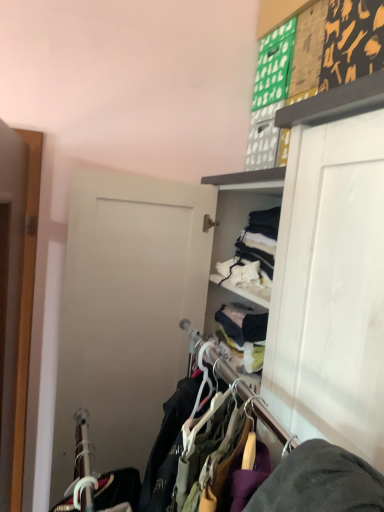
Question: Considering the relative positions of wooden door at left and wooden hangers at center in the image provided, is wooden door at left to the left or to the right of wooden hangers at center?

Choices:
 (A) right
 (B) left

Answer: (B)

Question: From a real-world perspective, is wooden door at left positioned above or below wooden hangers at center?

Choices:
 (A) below
 (B) above

Answer: (B)

Question: In terms of height, does wooden door at left look taller or shorter compared to wooden hangers at center?

Choices:
 (A) short
 (B) tall

Answer: (B)

Question: From a real-world perspective, is wooden hangers at center physically located above or below wooden door at left?

Choices:
 (A) below
 (B) above

Answer: (A)

Question: In the image, is wooden hangers at center positioned in front of or behind wooden door at left?

Choices:
 (A) front
 (B) behind

Answer: (A)

Question: From the image's perspective, relative to wooden door at left, is wooden hangers at center above or below?

Choices:
 (A) above
 (B) below

Answer: (B)

Question: Based on their sizes in the image, would you say wooden hangers at center is bigger or smaller than wooden door at left?

Choices:
 (A) big
 (B) small

Answer: (A)